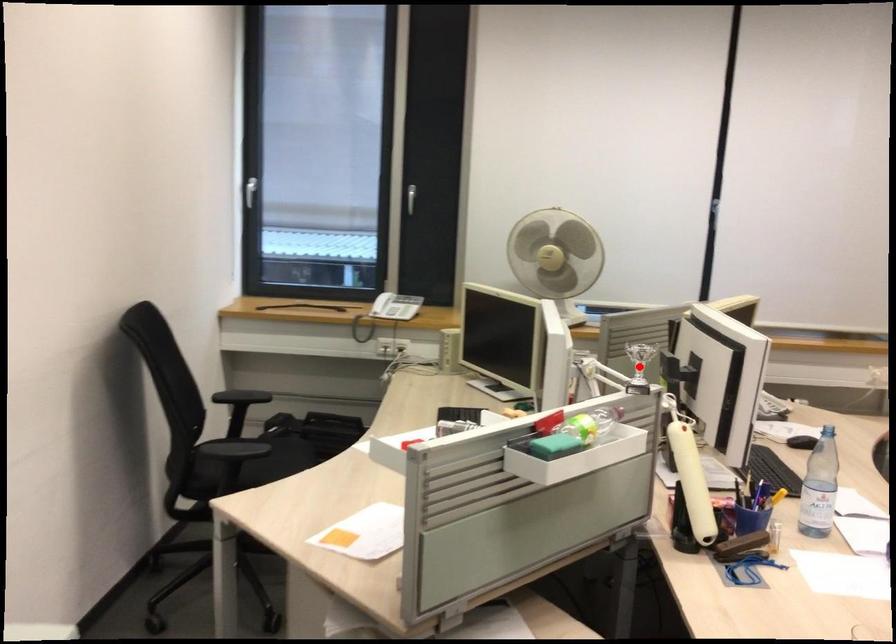
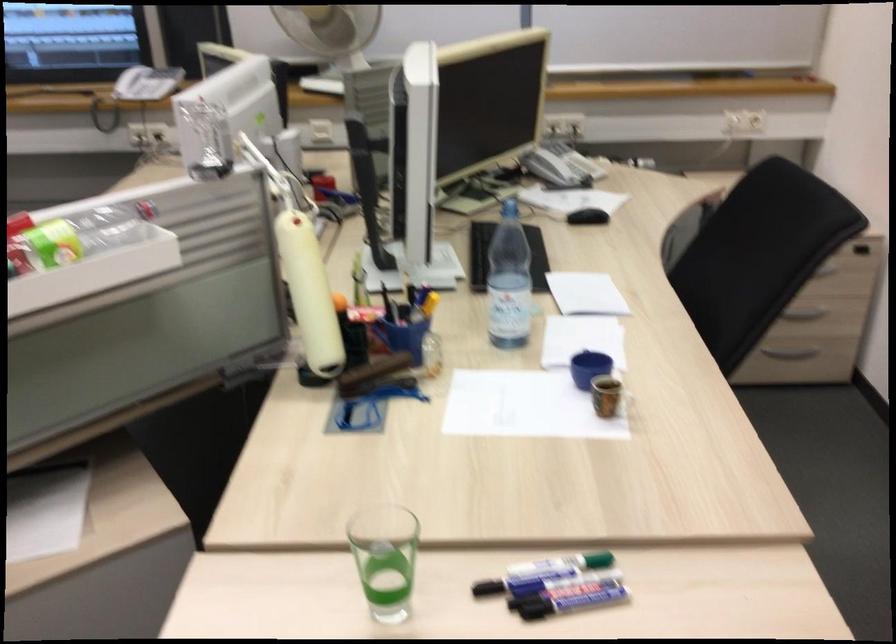
Question: I am providing you with two images of the same scene from different viewpoints. A red point is marked on the first image. Is the red point's position out of view in image 2?

Choices:
 (A) Yes
 (B) No

Answer: (A)